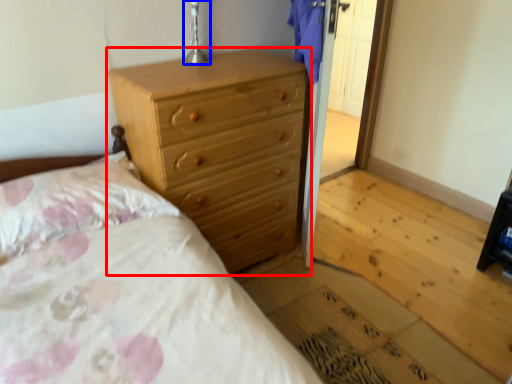
Question: Which object is closer to the camera taking this photo, chest of drawers (highlighted by a red box) or table lamp (highlighted by a blue box)?

Choices:
 (A) chest of drawers
 (B) table lamp

Answer: (A)